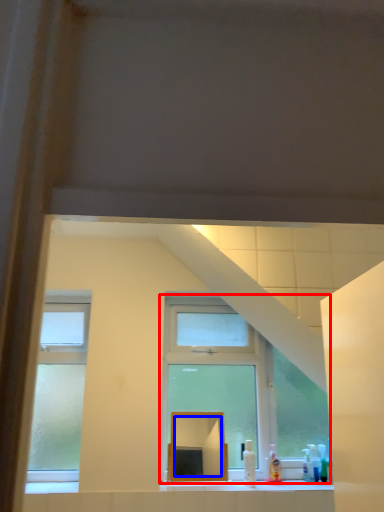
Question: Which point is closer to the camera, window (highlighted by a red box) or mirror (highlighted by a blue box)?

Choices:
 (A) window
 (B) mirror

Answer: (B)